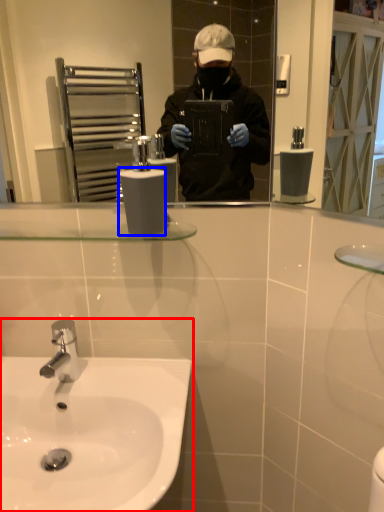
Question: Which object is closer to the camera taking this photo, sink (highlighted by a red box) or toilet paper (highlighted by a blue box)?

Choices:
 (A) sink
 (B) toilet paper

Answer: (A)